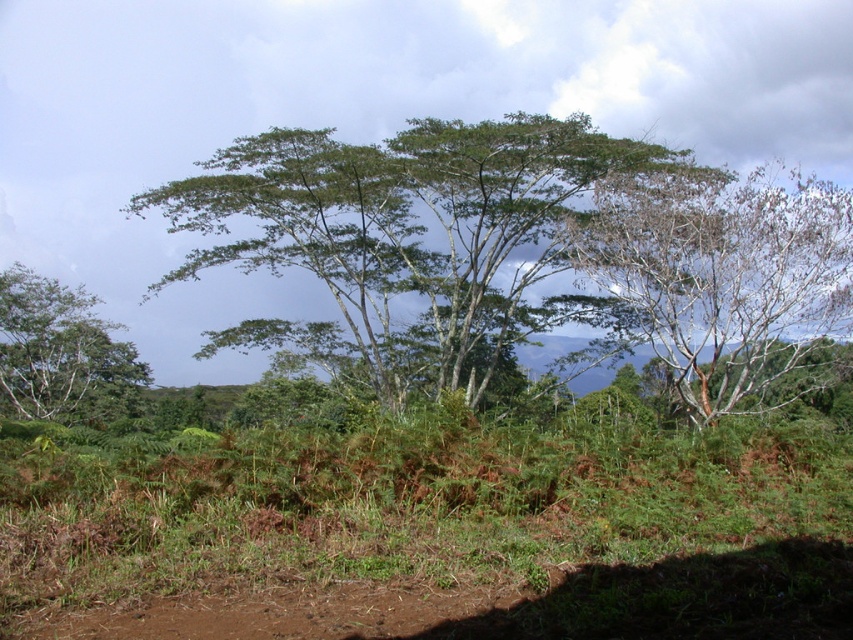
Question: From the image, what is the correct spatial relationship of green leafy tree at center in relation to green leafy tree at left?

Choices:
 (A) left
 (B) right

Answer: (B)

Question: Which object is the closest to the bare branches tree at right?

Choices:
 (A) green leafy tree at left
 (B) green leafy tree at center

Answer: (B)

Question: Does bare branches tree at right lie in front of green leafy tree at left?

Choices:
 (A) no
 (B) yes

Answer: (B)

Question: Among these objects, which one is nearest to the camera?

Choices:
 (A) green leafy tree at left
 (B) bare branches tree at right

Answer: (B)

Question: Estimate the real-world distances between objects in this image. Which object is farther from the bare branches tree at right?

Choices:
 (A) green leafy tree at center
 (B) green leafy tree at left

Answer: (B)

Question: Observing the image, what is the correct spatial positioning of green leafy tree at center in reference to green leafy tree at left?

Choices:
 (A) below
 (B) above

Answer: (B)